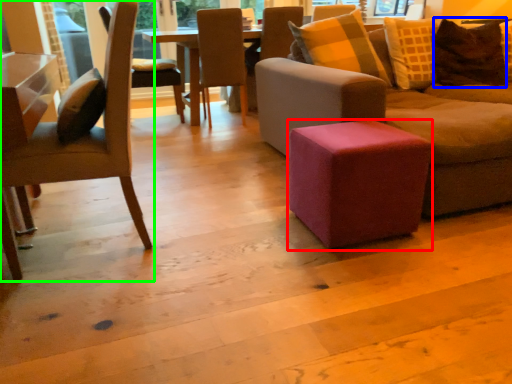
Question: Considering the real-world distances, which object is farthest from stool (highlighted by a red box)? pillow (highlighted by a blue box) or chair (highlighted by a green box)?

Choices:
 (A) pillow
 (B) chair

Answer: (A)